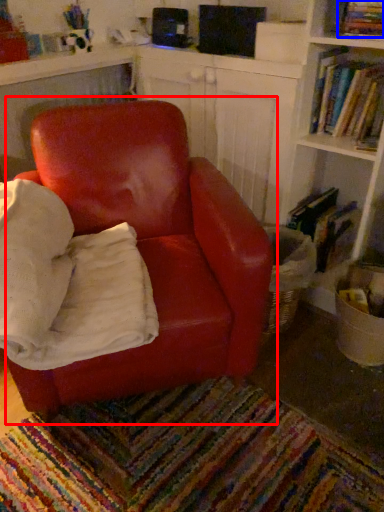
Question: Which object is closer to the camera taking this photo, chair (highlighted by a red box) or book (highlighted by a blue box)?

Choices:
 (A) chair
 (B) book

Answer: (A)